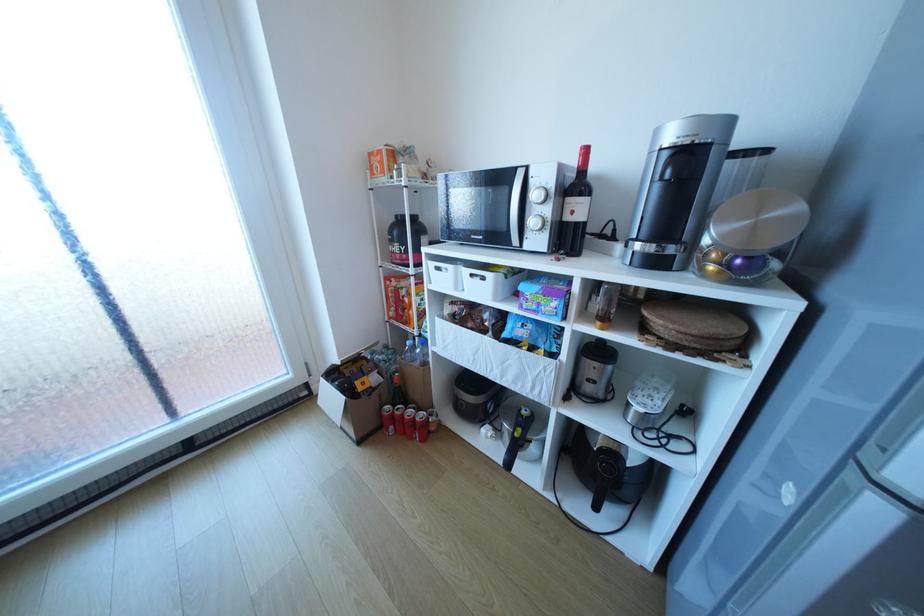
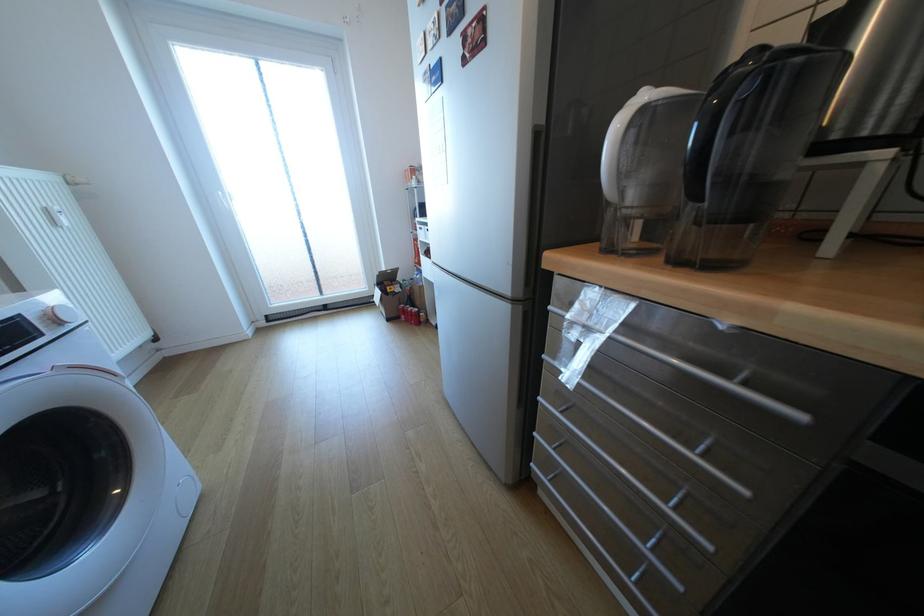
Locate, in the second image, the point that corresponds to the point at 367,383 in the first image.

(397, 288)